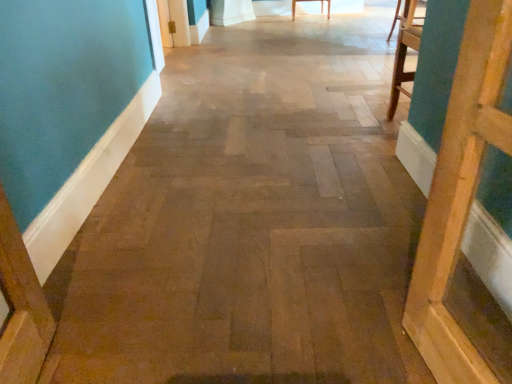
This screenshot has width=512, height=384. What are the coordinates of `wooden floor at center` in the screenshot? It's located at (251, 223).

Image resolution: width=512 pixels, height=384 pixels. Describe the element at coordinates (251, 223) in the screenshot. I see `wooden floor at center` at that location.

What is the approximate width of wooden floor at center?

The width of wooden floor at center is 17.03 feet.

Find the location of `wooden floor at center`. wooden floor at center is located at coordinates (251, 223).